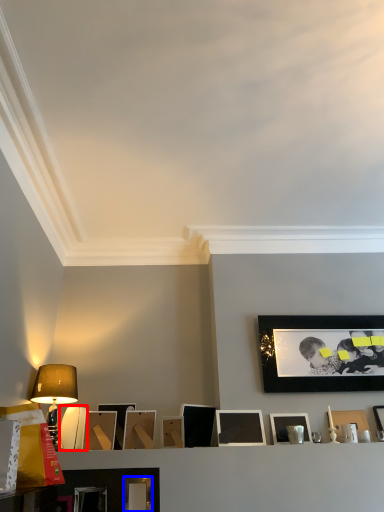
Question: Which object is closer to the camera taking this photo, picture frame (highlighted by a red box) or picture frame (highlighted by a blue box)?

Choices:
 (A) picture frame
 (B) picture frame

Answer: (B)